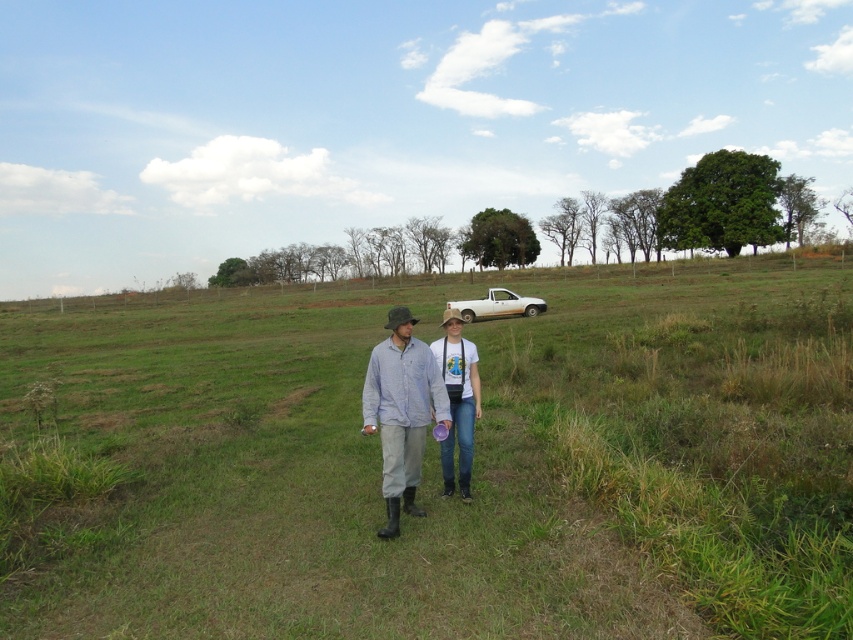
Question: Which object is positioned farthest from the green grass at center?

Choices:
 (A) light blue cotton shirt at center
 (B) white matte pickup truck at center

Answer: (A)

Question: From the image, what is the correct spatial relationship of green grass at center in relation to light blue cotton shirt at center?

Choices:
 (A) left
 (B) right

Answer: (B)

Question: Can you confirm if green grass at center is positioned below white matte pickup truck at center?

Choices:
 (A) no
 (B) yes

Answer: (A)

Question: Which of the following is the farthest from the observer?

Choices:
 (A) green grass at center
 (B) light blue cotton shirt at center
 (C) white cotton t-shirt at center
 (D) white matte pickup truck at center

Answer: (D)

Question: Is light blue cotton shirt at center above white matte pickup truck at center?

Choices:
 (A) yes
 (B) no

Answer: (B)

Question: Which point appears farthest from the camera in this image?

Choices:
 (A) (397, 442)
 (B) (463, 460)
 (C) (509, 308)
 (D) (53, 538)

Answer: (C)